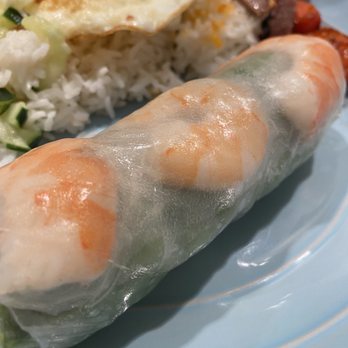
Find the location of a particular element. plate is located at coordinates point(320,282), point(326,9).